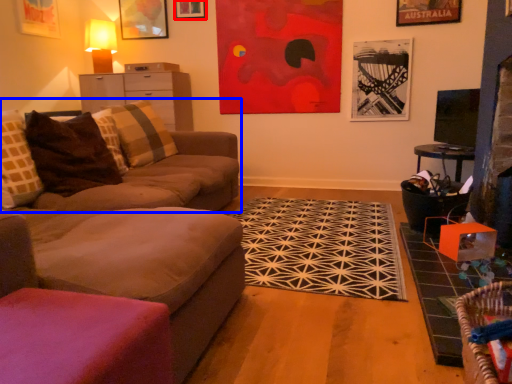
Question: Among these objects, which one is farthest to the camera, picture frame (highlighted by a red box) or studio couch (highlighted by a blue box)?

Choices:
 (A) picture frame
 (B) studio couch

Answer: (A)